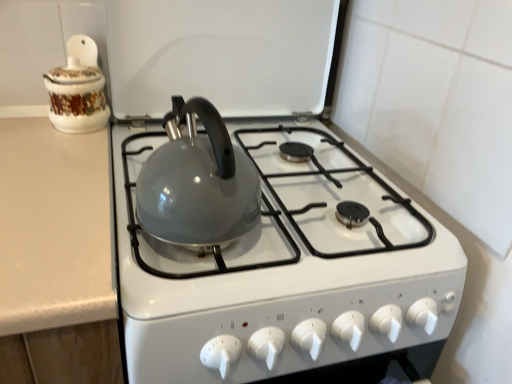
Where is `glossy ceramic kettle at center`? This screenshot has width=512, height=384. glossy ceramic kettle at center is located at coordinates (197, 182).

Describe the element at coordinates (197, 182) in the screenshot. Image resolution: width=512 pixels, height=384 pixels. I see `glossy ceramic kettle at center` at that location.

What do you see at coordinates (78, 89) in the screenshot?
I see `porcelain floral jar at upper left` at bounding box center [78, 89].

Find the location of `porcelain floral jar at upper left`. porcelain floral jar at upper left is located at coordinates (78, 89).

The width and height of the screenshot is (512, 384). Identify the location of glossy ceramic kettle at center. (197, 182).

Is porcelain floral jar at upper left to the left or to the right of glossy ceramic kettle at center in the image?

In the image, porcelain floral jar at upper left appears on the left side of glossy ceramic kettle at center.

Considering the positions of objects porcelain floral jar at upper left and glossy ceramic kettle at center in the image provided, who is behind, porcelain floral jar at upper left or glossy ceramic kettle at center?

porcelain floral jar at upper left is further from the camera.

Between point (54, 89) and point (169, 127), which one is positioned in front?

The point (169, 127) is closer.

From the image's perspective, is porcelain floral jar at upper left positioned above or below glossy ceramic kettle at center?

Based on their image positions, porcelain floral jar at upper left is located above glossy ceramic kettle at center.

From a real-world perspective, which is physically above, porcelain floral jar at upper left or glossy ceramic kettle at center?

From a 3D spatial view, porcelain floral jar at upper left is above.

Is porcelain floral jar at upper left wider than glossy ceramic kettle at center?

In fact, porcelain floral jar at upper left might be narrower than glossy ceramic kettle at center.

Which of these two, porcelain floral jar at upper left or glossy ceramic kettle at center, stands shorter?

porcelain floral jar at upper left.

Is porcelain floral jar at upper left bigger than glossy ceramic kettle at center?

Actually, porcelain floral jar at upper left might be smaller than glossy ceramic kettle at center.

Is glossy ceramic kettle at center located within porcelain floral jar at upper left?

No, glossy ceramic kettle at center is not a part of porcelain floral jar at upper left.

Would you say porcelain floral jar at upper left is a long distance from glossy ceramic kettle at center?

No, porcelain floral jar at upper left is not far from glossy ceramic kettle at center.

Does porcelain floral jar at upper left turn towards glossy ceramic kettle at center?

No, porcelain floral jar at upper left does not turn towards glossy ceramic kettle at center.

How different are the orientations of porcelain floral jar at upper left and glossy ceramic kettle at center in degrees?

The angular difference between porcelain floral jar at upper left and glossy ceramic kettle at center is 180 degrees.

How distant is porcelain floral jar at upper left from glossy ceramic kettle at center?

They are 36.29 centimeters apart.

Find the location of a particular element. Image resolution: width=512 pixels, height=384 pixels. kettle below the porcelain floral jar at upper left (from the image's perspective) is located at coordinates (197, 182).

Considering the positions of objects glossy ceramic kettle at center and porcelain floral jar at upper left in the image provided, who is more to the left, glossy ceramic kettle at center or porcelain floral jar at upper left?

porcelain floral jar at upper left is more to the left.

Does glossy ceramic kettle at center lie behind porcelain floral jar at upper left?

That is False.

Does point (174, 191) appear closer or farther from the camera than point (92, 51)?

Point (174, 191) is positioned closer to the camera compared to point (92, 51).

From the image's perspective, is glossy ceramic kettle at center on top of porcelain floral jar at upper left?

No, from the image's perspective, glossy ceramic kettle at center is not above porcelain floral jar at upper left.

From a real-world perspective, is glossy ceramic kettle at center over porcelain floral jar at upper left?

No, from a real-world perspective, glossy ceramic kettle at center is not over porcelain floral jar at upper left

Considering the relative sizes of glossy ceramic kettle at center and porcelain floral jar at upper left in the image provided, is glossy ceramic kettle at center wider than porcelain floral jar at upper left?

Correct, the width of glossy ceramic kettle at center exceeds that of porcelain floral jar at upper left.

In terms of height, does glossy ceramic kettle at center look taller or shorter compared to porcelain floral jar at upper left?

In the image, glossy ceramic kettle at center appears to be taller than porcelain floral jar at upper left.

Who is smaller, glossy ceramic kettle at center or porcelain floral jar at upper left?

porcelain floral jar at upper left is smaller.

Is glossy ceramic kettle at center situated inside porcelain floral jar at upper left or outside?

The correct answer is: outside.

Is glossy ceramic kettle at center far from porcelain floral jar at upper left?

Actually, glossy ceramic kettle at center and porcelain floral jar at upper left are a little close together.

Is glossy ceramic kettle at center positioned with its back to porcelain floral jar at upper left?

No, glossy ceramic kettle at center is not facing away from porcelain floral jar at upper left.

How many degrees apart are the facing directions of glossy ceramic kettle at center and porcelain floral jar at upper left?

180 degrees.

Where is `kettle below the porcelain floral jar at upper left (from a real-world perspective)`? Image resolution: width=512 pixels, height=384 pixels. kettle below the porcelain floral jar at upper left (from a real-world perspective) is located at coordinates (197, 182).

The image size is (512, 384). Identify the location of kitchen appliance on the left side of glossy ceramic kettle at center. (78, 89).

This screenshot has width=512, height=384. I want to click on kitchen appliance that appears above the glossy ceramic kettle at center (from a real-world perspective), so coord(78,89).